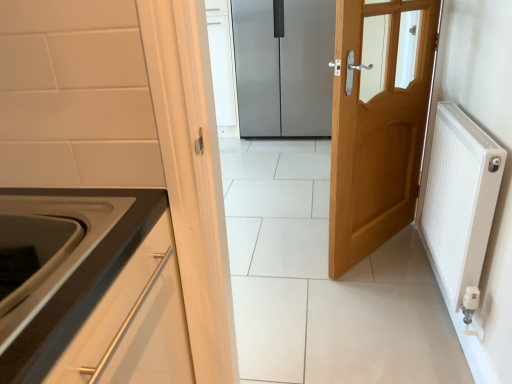
This screenshot has width=512, height=384. Find the location of `satin silver refrigerator at center, which appears as the 2th door when viewed from the front`. satin silver refrigerator at center, which appears as the 2th door when viewed from the front is located at coordinates (284, 67).

How much space does satin silver refrigerator at center, which appears as the 2th door when viewed from the front, occupy vertically?

satin silver refrigerator at center, which appears as the 2th door when viewed from the front, is 3.93 feet in height.

The image size is (512, 384). Describe the element at coordinates (68, 255) in the screenshot. I see `white glossy oven at lower left` at that location.

Where is `light wood door at center, the second door when ordered from back to front`? This screenshot has width=512, height=384. light wood door at center, the second door when ordered from back to front is located at coordinates (378, 121).

What do you see at coordinates (460, 198) in the screenshot?
I see `white ribbed radiator at right` at bounding box center [460, 198].

At what (x,y) coordinates should I click in order to perform the action: click on satin silver refrigerator at center, the first door from the back. Please return your answer as a coordinate pair (x, y). Looking at the image, I should click on (284, 67).

In terms of size, does white glossy oven at lower left appear bigger or smaller than white ribbed radiator at right?

white glossy oven at lower left is smaller than white ribbed radiator at right.

Who is taller, white glossy oven at lower left or white ribbed radiator at right?

With more height is white ribbed radiator at right.

Does point (105, 216) come behind point (494, 189)?

No, it is not.

Based on the photo, from a real-world perspective, does white glossy oven at lower left stand above white ribbed radiator at right?

Indeed, from a real-world perspective, white glossy oven at lower left stands above white ribbed radiator at right.

Which is nearer, (457,109) or (423,84)?

Point (457,109) appears to be closer to the viewer than point (423,84).

Is white ribbed radiator at right inside the boundaries of light wood door at center, acting as the first door starting from the front, or outside?

white ribbed radiator at right is not enclosed by light wood door at center, acting as the first door starting from the front.

You are a GUI agent. You are given a task and a screenshot of the screen. Output one action in this format:
    pyautogui.click(x=<x>, y=<y>)
    Task: Click on the 1st door behind the white ribbed radiator at right
    
    Given the screenshot: What is the action you would take?
    pyautogui.click(x=378, y=121)

From the image's perspective, would you say white ribbed radiator at right is positioned over light wood door at center, the second door when ordered from back to front?

No, from the image's perspective, white ribbed radiator at right is not over light wood door at center, the second door when ordered from back to front.

Consider the image. From the image's perspective, which object appears higher, satin silver refrigerator at center, the first door from the back, or light wood door at center, acting as the first door starting from the front?

satin silver refrigerator at center, the first door from the back, from the image's perspective.

Is satin silver refrigerator at center, the first door from the back, with light wood door at center, acting as the first door starting from the front?

They are not placed beside each other.

Is satin silver refrigerator at center, the first door from the back, positioned in front of light wood door at center, the second door when ordered from back to front?

No, it is not.

Looking at this image, measure the distance between white ribbed radiator at right and satin silver refrigerator at center, which appears as the 2th door when viewed from the front.

white ribbed radiator at right and satin silver refrigerator at center, which appears as the 2th door when viewed from the front, are 2.24 meters apart from each other.

Considering the relative sizes of white ribbed radiator at right and satin silver refrigerator at center, which appears as the 2th door when viewed from the front, in the image provided, is white ribbed radiator at right shorter than satin silver refrigerator at center, which appears as the 2th door when viewed from the front,?

Indeed, white ribbed radiator at right has a lesser height compared to satin silver refrigerator at center, which appears as the 2th door when viewed from the front.

Is white ribbed radiator at right wider than satin silver refrigerator at center, which appears as the 2th door when viewed from the front?

No, white ribbed radiator at right is not wider than satin silver refrigerator at center, which appears as the 2th door when viewed from the front.

Is point (476, 278) positioned behind point (327, 79)?

No, it is not.

Which of these two, satin silver refrigerator at center, the first door from the back, or white glossy oven at lower left, is smaller?

With smaller size is white glossy oven at lower left.

Is satin silver refrigerator at center, which appears as the 2th door when viewed from the front, turned away from white glossy oven at lower left?

satin silver refrigerator at center, which appears as the 2th door when viewed from the front, is not turned away from white glossy oven at lower left.

From the image's perspective, which one is positioned lower, satin silver refrigerator at center, which appears as the 2th door when viewed from the front, or white glossy oven at lower left?

white glossy oven at lower left.

What's the angular difference between light wood door at center, the second door when ordered from back to front, and satin silver refrigerator at center, which appears as the 2th door when viewed from the front,'s facing directions?

127 degrees separate the facing orientations of light wood door at center, the second door when ordered from back to front, and satin silver refrigerator at center, which appears as the 2th door when viewed from the front.

From a real-world perspective, between light wood door at center, acting as the first door starting from the front, and satin silver refrigerator at center, which appears as the 2th door when viewed from the front, who is vertically lower?

light wood door at center, acting as the first door starting from the front, is physically lower.

Considering the sizes of objects light wood door at center, acting as the first door starting from the front, and satin silver refrigerator at center, which appears as the 2th door when viewed from the front, in the image provided, who is smaller, light wood door at center, acting as the first door starting from the front, or satin silver refrigerator at center, which appears as the 2th door when viewed from the front,?

light wood door at center, acting as the first door starting from the front.

Between light wood door at center, acting as the first door starting from the front, and satin silver refrigerator at center, which appears as the 2th door when viewed from the front, which one has smaller width?

With smaller width is light wood door at center, acting as the first door starting from the front.

From a real-world perspective, is light wood door at center, acting as the first door starting from the front, over white ribbed radiator at right?

Correct, in the physical world, light wood door at center, acting as the first door starting from the front, is higher than white ribbed radiator at right.

Between light wood door at center, acting as the first door starting from the front, and white ribbed radiator at right, which one is positioned in front?

white ribbed radiator at right.

Who is shorter, light wood door at center, the second door when ordered from back to front, or white ribbed radiator at right?

white ribbed radiator at right is shorter.

From the image's perspective, which is below, light wood door at center, acting as the first door starting from the front, or white ribbed radiator at right?

white ribbed radiator at right.

Locate an element on the screen. This screenshot has height=384, width=512. oven located below the white ribbed radiator at right (from the image's perspective) is located at coordinates (68, 255).

Locate an element on the screen. the 1st door to the left of the white ribbed radiator at right, counting from the anchor's position is located at coordinates (378, 121).

Considering their positions, is white glossy oven at lower left positioned further to light wood door at center, acting as the first door starting from the front, than satin silver refrigerator at center, the first door from the back?

satin silver refrigerator at center, the first door from the back.

Considering their positions, is white ribbed radiator at right positioned further to light wood door at center, the second door when ordered from back to front, than white glossy oven at lower left?

white glossy oven at lower left.

When comparing their distances from satin silver refrigerator at center, which appears as the 2th door when viewed from the front, does white glossy oven at lower left or white ribbed radiator at right seem further?

Based on the image, white glossy oven at lower left appears to be further to satin silver refrigerator at center, which appears as the 2th door when viewed from the front.

Based on their spatial positions, is white glossy oven at lower left or light wood door at center, the second door when ordered from back to front, further from satin silver refrigerator at center, which appears as the 2th door when viewed from the front?

The object further to satin silver refrigerator at center, which appears as the 2th door when viewed from the front, is white glossy oven at lower left.

Looking at the image, which one is located further to white glossy oven at lower left, satin silver refrigerator at center, which appears as the 2th door when viewed from the front, or light wood door at center, the second door when ordered from back to front?

satin silver refrigerator at center, which appears as the 2th door when viewed from the front, is positioned further to the anchor white glossy oven at lower left.

Based on their spatial positions, is white ribbed radiator at right or satin silver refrigerator at center, the first door from the back, closer to light wood door at center, acting as the first door starting from the front?

white ribbed radiator at right is positioned closer to the anchor light wood door at center, acting as the first door starting from the front.

Estimate the real-world distances between objects in this image. Which object is closer to light wood door at center, the second door when ordered from back to front, satin silver refrigerator at center, which appears as the 2th door when viewed from the front, or white ribbed radiator at right?

Based on the image, white ribbed radiator at right appears to be nearer to light wood door at center, the second door when ordered from back to front.

From the picture: Considering their positions, is light wood door at center, the second door when ordered from back to front, positioned closer to satin silver refrigerator at center, the first door from the back, than white ribbed radiator at right?

light wood door at center, the second door when ordered from back to front.

Where is `door between white glossy oven at lower left and satin silver refrigerator at center, which appears as the 2th door when viewed from the front, from front to back`? The width and height of the screenshot is (512, 384). door between white glossy oven at lower left and satin silver refrigerator at center, which appears as the 2th door when viewed from the front, from front to back is located at coordinates (378, 121).

At what (x,y) coordinates should I click in order to perform the action: click on radiator between white glossy oven at lower left and satin silver refrigerator at center, which appears as the 2th door when viewed from the front, in the front-back direction. Please return your answer as a coordinate pair (x, y). This screenshot has height=384, width=512. Looking at the image, I should click on (460, 198).

Find the location of a particular element. Image resolution: width=512 pixels, height=384 pixels. door between white ribbed radiator at right and satin silver refrigerator at center, which appears as the 2th door when viewed from the front, along the z-axis is located at coordinates (378, 121).